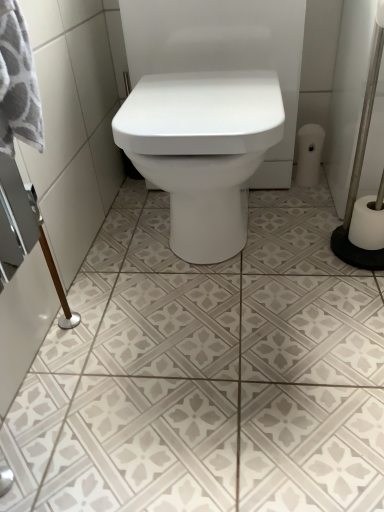
Question: Does white textured tile at center have a greater height compared to white matte toilet paper at right, the 1th toilet paper positioned from the left?

Choices:
 (A) no
 (B) yes

Answer: (A)

Question: Is white matte toilet paper at right, which ranks as the 1th toilet paper in back-to-front order, surrounded by white textured tile at center?

Choices:
 (A) yes
 (B) no

Answer: (B)

Question: Does white textured tile at center have a lesser width compared to white matte toilet paper at right, the second toilet paper positioned from the front?

Choices:
 (A) yes
 (B) no

Answer: (B)

Question: Considering the relative sizes of white textured tile at center and white matte toilet paper at right, which ranks as the 1th toilet paper in back-to-front order, in the image provided, is white textured tile at center shorter than white matte toilet paper at right, which ranks as the 1th toilet paper in back-to-front order,?

Choices:
 (A) no
 (B) yes

Answer: (B)

Question: Can you confirm if white textured tile at center is positioned to the left of white matte toilet paper at right, marked as the second toilet paper in a right-to-left arrangement?

Choices:
 (A) yes
 (B) no

Answer: (A)

Question: Can you confirm if white textured tile at center is bigger than white matte toilet paper at right, which is the second toilet paper from bottom to top?

Choices:
 (A) no
 (B) yes

Answer: (B)

Question: Considering the relative sizes of white matte toilet paper at right, placed as the 1th toilet paper when sorted from right to left, and white matte toilet paper at right, which is counted as the 1th toilet paper, starting from the top, in the image provided, is white matte toilet paper at right, placed as the 1th toilet paper when sorted from right to left, taller than white matte toilet paper at right, which is counted as the 1th toilet paper, starting from the top,?

Choices:
 (A) no
 (B) yes

Answer: (A)

Question: Considering the relative positions of white matte toilet paper at right, placed as the 1th toilet paper when sorted from right to left, and white matte toilet paper at right, marked as the second toilet paper in a right-to-left arrangement, in the image provided, is white matte toilet paper at right, placed as the 1th toilet paper when sorted from right to left, to the right of white matte toilet paper at right, marked as the second toilet paper in a right-to-left arrangement, from the viewer's perspective?

Choices:
 (A) yes
 (B) no

Answer: (A)

Question: From a real-world perspective, is white matte toilet paper at right, placed as the 1th toilet paper when sorted from right to left, below white matte toilet paper at right, which ranks as the 1th toilet paper in back-to-front order?

Choices:
 (A) yes
 (B) no

Answer: (A)

Question: Is white matte toilet paper at right, which is the 1th toilet paper in bottom-to-top order, positioned behind white matte toilet paper at right, the second toilet paper positioned from the front?

Choices:
 (A) yes
 (B) no

Answer: (B)

Question: Is white matte toilet paper at right, acting as the 2th toilet paper starting from the back, beside white matte toilet paper at right, the 1th toilet paper positioned from the left?

Choices:
 (A) no
 (B) yes

Answer: (A)

Question: Is white matte toilet paper at right, marked as the second toilet paper in a right-to-left arrangement, surrounded by white matte toilet paper at right, which is the 1th toilet paper in bottom-to-top order?

Choices:
 (A) yes
 (B) no

Answer: (B)

Question: From the image's perspective, is white matte toilet paper at right, marked as the second toilet paper in a right-to-left arrangement, under white textured tile at center?

Choices:
 (A) yes
 (B) no

Answer: (B)